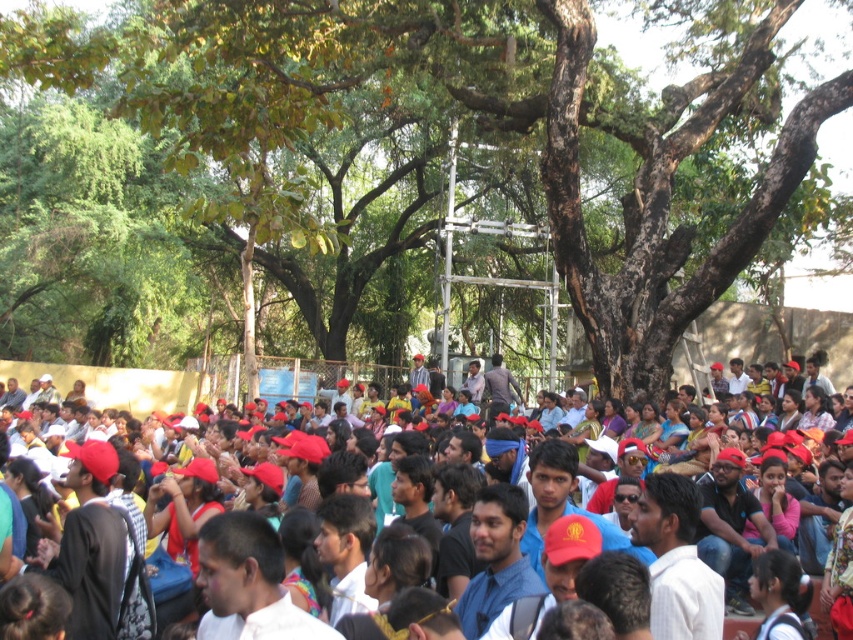
You are a photographer trying to capture a photo of the red matte cap at center without the brown rough tree at center blocking it. Since the tree is larger, can you adjust your angle to avoid the tree while still framing the cap?

The brown rough tree at center is larger in size than the red matte cap at center, so adjusting your angle might be possible. However, since both are at the center, you may need to move sideways to position the cap away from the tree or zoom in to focus on the cap while excluding the tree from the frame.

You are a photographer at the event and want to capture a photo that includes both the brown rough tree at center and the red matte cap at center. Based on their positions, which object should you adjust your camera to focus on first to ensure both are in the frame?

The brown rough tree at center is to the left of red matte cap at center, so you should focus on the brown rough tree at center first to ensure both are in the frame.

You are organizing a small event and need to place a 1.5 meter wide banner between the brown rough tree at center and the red matte cap at center. Based on their widths, can the banner fit between them without overlapping either object?

The brown rough tree at center might be wider than red matte cap at center, so the banner might not fit between them without overlapping the wider tree.